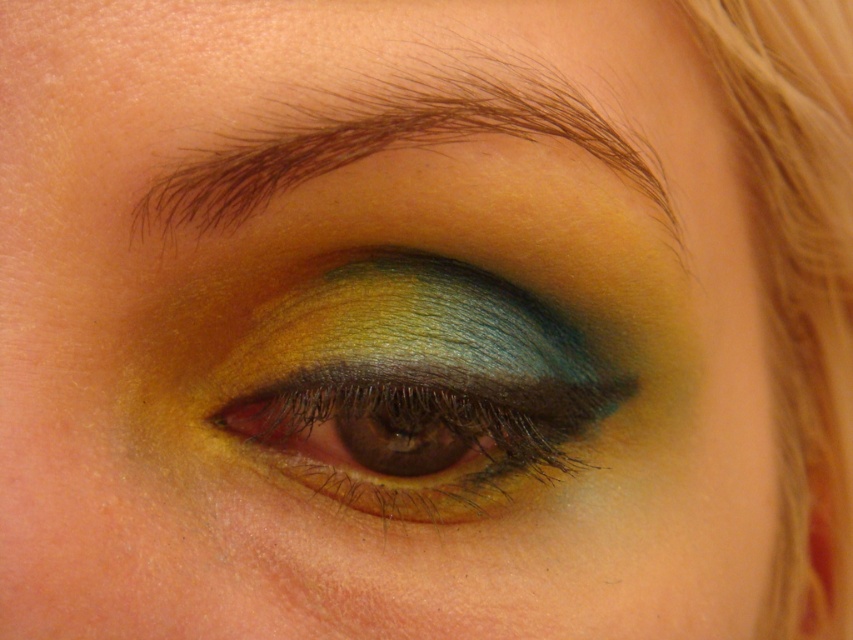
Question: Which point is closer to the camera?

Choices:
 (A) metallic shimmering eye at center
 (B) brownhair-likeeyebrow at upper center

Answer: (B)

Question: Does metallic shimmering eye at center have a lesser width compared to brownhair-likeeyebrow at upper center?

Choices:
 (A) yes
 (B) no

Answer: (A)

Question: Which point is farther to the camera?

Choices:
 (A) metallic shimmering eye at center
 (B) brownhair-likeeyebrow at upper center

Answer: (A)

Question: Does metallic shimmering eye at center have a greater width compared to brownhair-likeeyebrow at upper center?

Choices:
 (A) yes
 (B) no

Answer: (B)

Question: Can you confirm if metallic shimmering eye at center is positioned above brownhair-likeeyebrow at upper center?

Choices:
 (A) yes
 (B) no

Answer: (B)